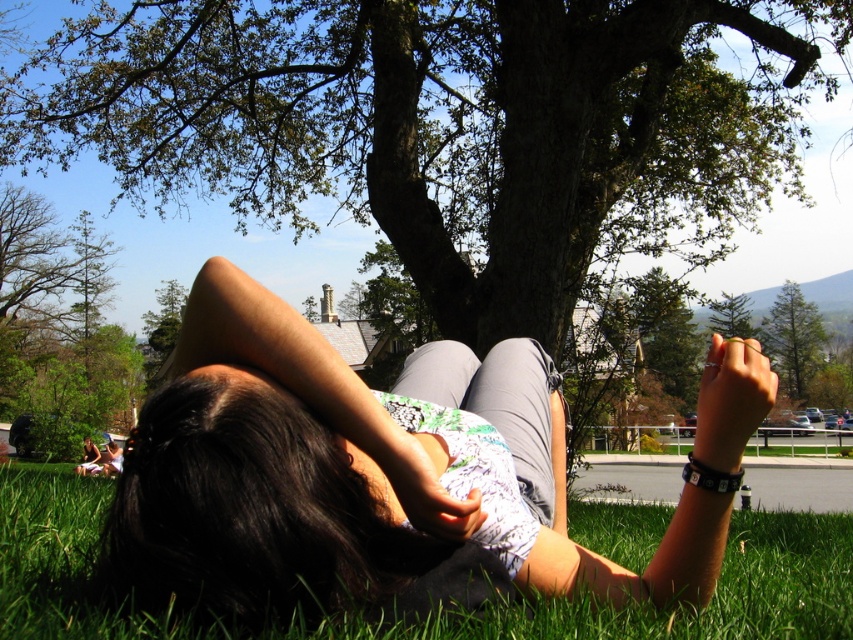
Between green leafy tree at upper center and green leafy tree at upper right, which one has more height?

With more height is green leafy tree at upper right.

Locate an element on the screen. The width and height of the screenshot is (853, 640). green leafy tree at upper center is located at coordinates (444, 125).

In the scene shown: Can you confirm if green grass at lower left is shorter than green leafy tree at upper right?

Indeed, green grass at lower left has a lesser height compared to green leafy tree at upper right.

What do you see at coordinates (686, 611) in the screenshot? The width and height of the screenshot is (853, 640). I see `green grass at lower left` at bounding box center [686, 611].

Locate an element on the screen. The height and width of the screenshot is (640, 853). green grass at lower left is located at coordinates (686, 611).

Does green leafy tree at upper center appear on the left side of smooth skin at center?

In fact, green leafy tree at upper center is to the right of smooth skin at center.

This screenshot has height=640, width=853. Describe the element at coordinates (444, 125) in the screenshot. I see `green leafy tree at upper center` at that location.

Locate an element on the screen. green leafy tree at upper center is located at coordinates (444, 125).